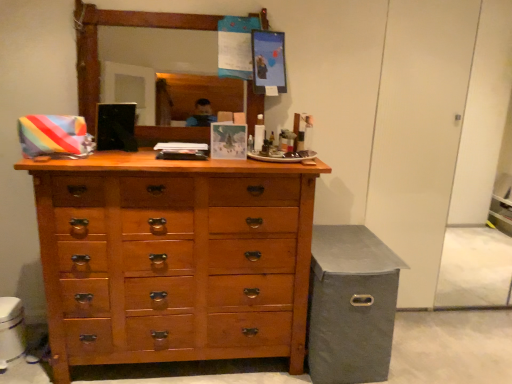
Question: Considering the relative sizes of gray fabric storage bin at lower right and wooden chest of drawers at center in the image provided, is gray fabric storage bin at lower right thinner than wooden chest of drawers at center?

Choices:
 (A) yes
 (B) no

Answer: (B)

Question: Is gray fabric storage bin at lower right further to camera compared to wooden chest of drawers at center?

Choices:
 (A) yes
 (B) no

Answer: (A)

Question: Is gray fabric storage bin at lower right to the left of wooden chest of drawers at center from the viewer's perspective?

Choices:
 (A) no
 (B) yes

Answer: (A)

Question: From a real-world perspective, does gray fabric storage bin at lower right stand above wooden chest of drawers at center?

Choices:
 (A) no
 (B) yes

Answer: (A)

Question: Is gray fabric storage bin at lower right shorter than wooden chest of drawers at center?

Choices:
 (A) no
 (B) yes

Answer: (B)

Question: Does gray fabric storage bin at lower right appear on the right side of wooden chest of drawers at center?

Choices:
 (A) no
 (B) yes

Answer: (B)

Question: Is wooden chest of drawers at center next to gray fabric storage bin at lower right?

Choices:
 (A) no
 (B) yes

Answer: (A)

Question: From a real-world perspective, is wooden chest of drawers at center positioned under gray fabric storage bin at lower right based on gravity?

Choices:
 (A) yes
 (B) no

Answer: (B)

Question: Would you say wooden chest of drawers at center is a long distance from gray fabric storage bin at lower right?

Choices:
 (A) no
 (B) yes

Answer: (A)

Question: From the image's perspective, is wooden chest of drawers at center located beneath gray fabric storage bin at lower right?

Choices:
 (A) no
 (B) yes

Answer: (A)

Question: Does wooden chest of drawers at center come in front of gray fabric storage bin at lower right?

Choices:
 (A) yes
 (B) no

Answer: (A)

Question: Is wooden chest of drawers at center further to camera compared to gray fabric storage bin at lower right?

Choices:
 (A) yes
 (B) no

Answer: (B)

Question: Which is correct: gray fabric storage bin at lower right is inside wooden chest of drawers at center, or outside of it?

Choices:
 (A) inside
 (B) outside

Answer: (B)